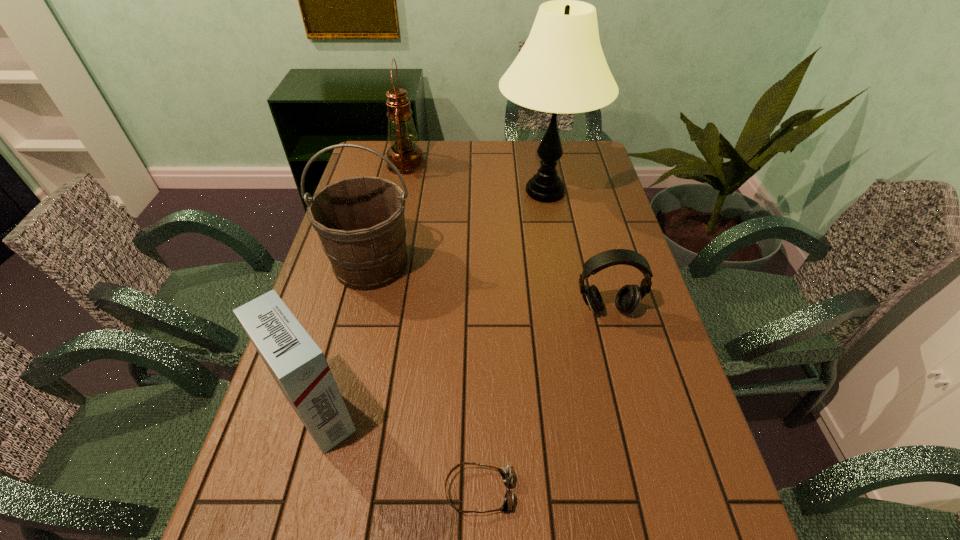
The image size is (960, 540). Identify the location of vacant space that satisfies the following two spatial constraints: 1. on the ear cups of the third nearest object; 2. on the front-facing side of the nearest object. (653, 491).

You are a GUI agent. You are given a task and a screenshot of the screen. Output one action in this format:
    pyautogui.click(x=<x>, y=<y>)
    Task: Click on the free location that satisfies the following two spatial constraints: 1. on the back side of the third farthest object; 2. on the right side of the oil lamp
    This screenshot has width=960, height=540.
    Given the screenshot: What is the action you would take?
    pyautogui.click(x=396, y=165)

Identify the location of free location that satisfies the following two spatial constraints: 1. on the back side of the tallest object; 2. on the left side of the bucket. (389, 192).